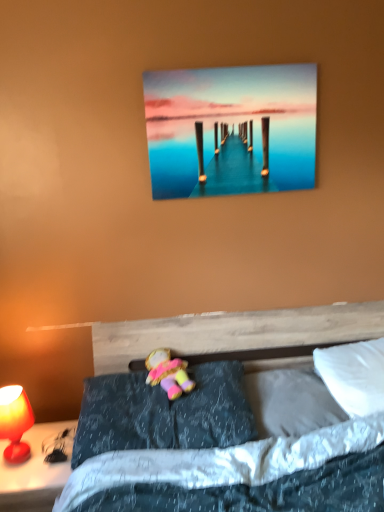
Question: Is white soft pillow at lower right, which is the second pillow from right to left, to the left of metallic glossy pier at upper center from the viewer's perspective?

Choices:
 (A) no
 (B) yes

Answer: (A)

Question: Is white soft pillow at lower right, which is the second pillow from right to left, thinner than metallic glossy pier at upper center?

Choices:
 (A) no
 (B) yes

Answer: (A)

Question: From the image's perspective, is white soft pillow at lower right, which appears as the 2th pillow when viewed from the left, on metallic glossy pier at upper center?

Choices:
 (A) yes
 (B) no

Answer: (B)

Question: Considering the relative sizes of white soft pillow at lower right, which is the second pillow from right to left, and metallic glossy pier at upper center in the image provided, is white soft pillow at lower right, which is the second pillow from right to left, smaller than metallic glossy pier at upper center?

Choices:
 (A) yes
 (B) no

Answer: (B)

Question: Considering the relative sizes of white soft pillow at lower right, which appears as the 2th pillow when viewed from the left, and metallic glossy pier at upper center in the image provided, is white soft pillow at lower right, which appears as the 2th pillow when viewed from the left, bigger than metallic glossy pier at upper center?

Choices:
 (A) yes
 (B) no

Answer: (A)

Question: Is white soft pillow at lower right, which is the second pillow from right to left, further to the viewer compared to metallic glossy pier at upper center?

Choices:
 (A) yes
 (B) no

Answer: (B)

Question: From the image's perspective, is matte red lamp at lower left located beneath white soft pillow at lower right, which appears as the 2th pillow when viewed from the left?

Choices:
 (A) yes
 (B) no

Answer: (A)

Question: Is matte red lamp at lower left far from white soft pillow at lower right, which is the second pillow from right to left?

Choices:
 (A) yes
 (B) no

Answer: (B)

Question: Is matte red lamp at lower left behind white soft pillow at lower right, which appears as the 2th pillow when viewed from the left?

Choices:
 (A) no
 (B) yes

Answer: (A)

Question: Would you say matte red lamp at lower left is outside white soft pillow at lower right, which is the second pillow from right to left?

Choices:
 (A) yes
 (B) no

Answer: (A)

Question: Is matte red lamp at lower left positioned with its back to white soft pillow at lower right, which is the second pillow from right to left?

Choices:
 (A) yes
 (B) no

Answer: (B)

Question: Considering the relative sizes of matte red lamp at lower left and white soft pillow at lower right, which appears as the 2th pillow when viewed from the left, in the image provided, is matte red lamp at lower left smaller than white soft pillow at lower right, which appears as the 2th pillow when viewed from the left,?

Choices:
 (A) yes
 (B) no

Answer: (B)

Question: From the image's perspective, would you say matte red lamp at lower left is shown under metallic glossy pier at upper center?

Choices:
 (A) no
 (B) yes

Answer: (B)